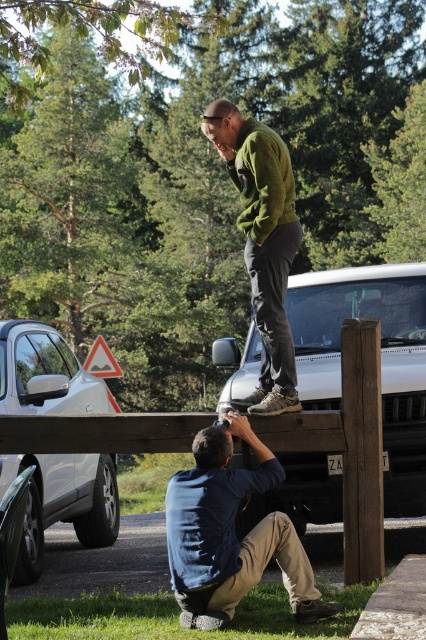
Can you confirm if white matte car at center is wider than silver metallic car at left?

Correct, the width of white matte car at center exceeds that of silver metallic car at left.

Locate an element on the screen. The width and height of the screenshot is (426, 640). white matte car at center is located at coordinates (380, 358).

The width and height of the screenshot is (426, 640). Find the location of `white matte car at center`. white matte car at center is located at coordinates (380, 358).

Is blue denim shirt at lower center wider than green matte sweater at upper center?

Yes, blue denim shirt at lower center is wider than green matte sweater at upper center.

Which is below, blue denim shirt at lower center or green matte sweater at upper center?

blue denim shirt at lower center is lower down.

Is point (259, 472) positioned behind point (287, 152)?

No, (259, 472) is in front of (287, 152).

At what (x,y) coordinates should I click in order to perform the action: click on blue denim shirt at lower center. Please return your answer as a coordinate pair (x, y). Looking at the image, I should click on (230, 532).

Is silver metallic car at left closer to camera compared to green matte sweater at upper center?

No, silver metallic car at left is further to the viewer.

How much distance is there between silver metallic car at left and green matte sweater at upper center?

The distance of silver metallic car at left from green matte sweater at upper center is 8.22 feet.

Is point (45, 394) more distant than point (247, 262)?

Yes, it is behind point (247, 262).

You are a GUI agent. You are given a task and a screenshot of the screen. Output one action in this format:
    pyautogui.click(x=<x>, y=<y>)
    Task: Click on the silver metallic car at left
    The height and width of the screenshot is (640, 426).
    Given the screenshot: What is the action you would take?
    pyautogui.click(x=63, y=502)